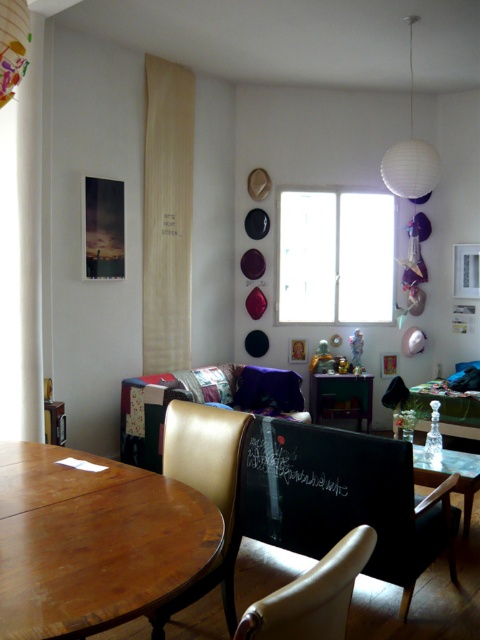
Does point (204, 492) lie in front of point (312, 628)?

No.

Is point (227, 488) closer to camera compared to point (324, 637)?

No, (227, 488) is further to viewer.

This screenshot has width=480, height=640. I want to click on leather-like chair at lower left, so click(204, 490).

Which is more to the right, wooden curtain at upper left or wooden table at center?

From the viewer's perspective, wooden table at center appears more on the right side.

Who is more forward, (167, 252) or (355, 385)?

Positioned in front is point (167, 252).

Between point (180, 323) and point (327, 388), which one is positioned behind?

The point (327, 388) is more distant.

Where is `wooden curtain at upper left`? The height and width of the screenshot is (640, 480). wooden curtain at upper left is located at coordinates (167, 216).

Does wooden round table at lower left have a larger size compared to wooden table at center?

Incorrect, wooden round table at lower left is not larger than wooden table at center.

Who is higher up, wooden round table at lower left or wooden table at center?

wooden round table at lower left

You are a GUI agent. You are given a task and a screenshot of the screen. Output one action in this format:
    pyautogui.click(x=<x>, y=<y>)
    Task: Click on the wooden round table at lower left
    This screenshot has height=640, width=480.
    Given the screenshot: What is the action you would take?
    pyautogui.click(x=93, y=541)

You are a GUI agent. You are given a task and a screenshot of the screen. Output one action in this format:
    pyautogui.click(x=<x>, y=<y>)
    Task: Click on the wooden round table at lower left
    
    Given the screenshot: What is the action you would take?
    pyautogui.click(x=93, y=541)